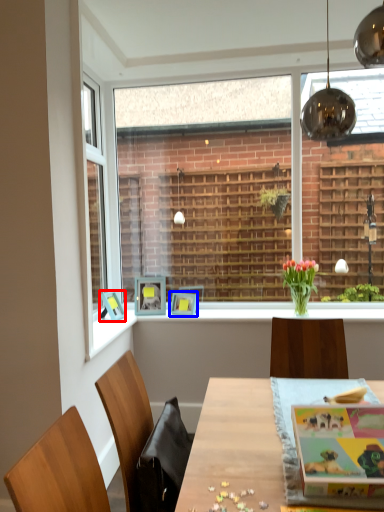
Question: Which object is closer to the camera taking this photo, picture frame (highlighted by a red box) or picture frame (highlighted by a blue box)?

Choices:
 (A) picture frame
 (B) picture frame

Answer: (A)